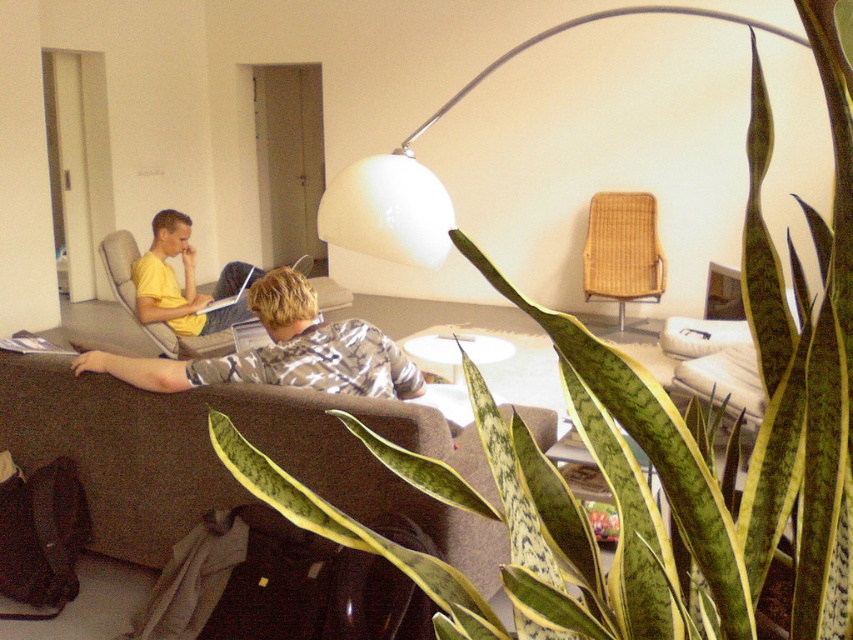
Is point (611, 241) positioned behind point (300, 259)?

That is False.

Is woven wicker chair at center closer to camera compared to matte gray armchair at left?

That is False.

The image size is (853, 640). Describe the element at coordinates (622, 250) in the screenshot. I see `woven wicker chair at center` at that location.

Identify the location of woven wicker chair at center. (622, 250).

Is point (555, 419) farther from viewer compared to point (643, 202)?

That is False.

Does point (144, 500) come in front of point (611, 198)?

Yes.

Is point (281, 451) closer to camera compared to point (589, 252)?

Yes.

The width and height of the screenshot is (853, 640). I want to click on brown fabric couch at lower center, so click(221, 465).

You are a GUI agent. You are given a task and a screenshot of the screen. Output one action in this format:
    pyautogui.click(x=<x>, y=<y>)
    Task: Click on the white glossy arc lamp at upper center
    The image size is (853, 640).
    Given the screenshot: What is the action you would take?
    pyautogui.click(x=434, y=176)

Which is behind, point (474, 84) or point (636, 282)?

The point (636, 282) is behind.

Find the location of a particular element. white glossy arc lamp at upper center is located at coordinates (434, 176).